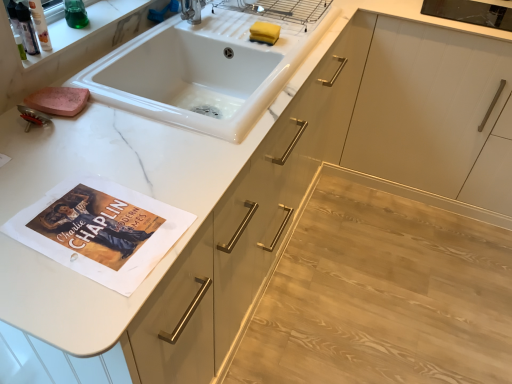
What are the coordinates of `vacant space to the right of yellow sponge at sink` in the screenshot? It's located at (297, 40).